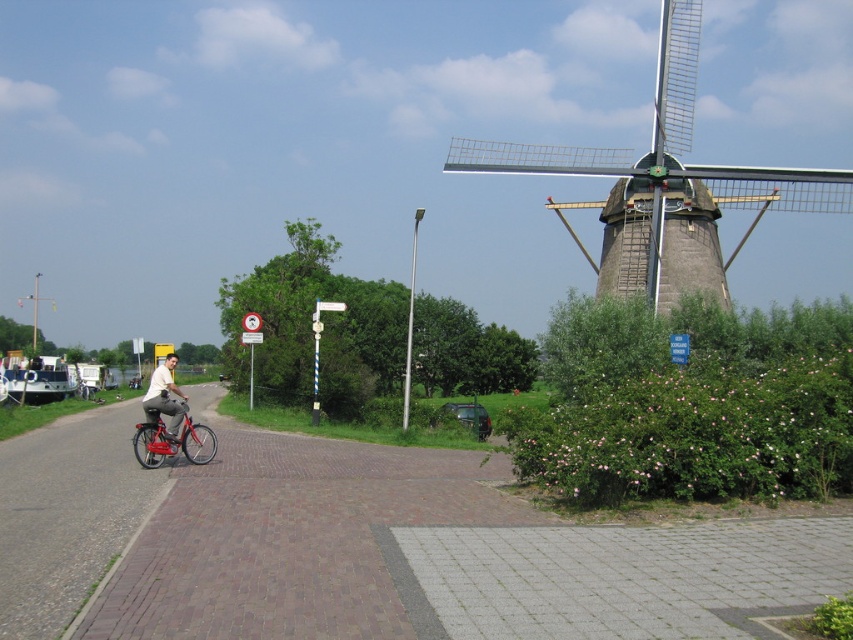
Question: Which object appears farthest from the camera in this image?

Choices:
 (A) gray stone windmill at upper right
 (B) matte white shirt at center
 (C) metallic red bicycle at left

Answer: (A)

Question: Does gray stone windmill at upper right have a greater width compared to matte white shirt at center?

Choices:
 (A) yes
 (B) no

Answer: (A)

Question: Among these objects, which one is farthest from the camera?

Choices:
 (A) metallic red bicycle at left
 (B) matte white shirt at center
 (C) gray stone windmill at upper right

Answer: (C)

Question: Is gray stone windmill at upper right to the left of metallic red bicycle at left from the viewer's perspective?

Choices:
 (A) no
 (B) yes

Answer: (A)

Question: Estimate the real-world distances between objects in this image. Which object is closer to the gray stone windmill at upper right?

Choices:
 (A) metallic red bicycle at left
 (B) matte white shirt at center

Answer: (A)

Question: Can you confirm if metallic red bicycle at left is smaller than matte white shirt at center?

Choices:
 (A) yes
 (B) no

Answer: (A)